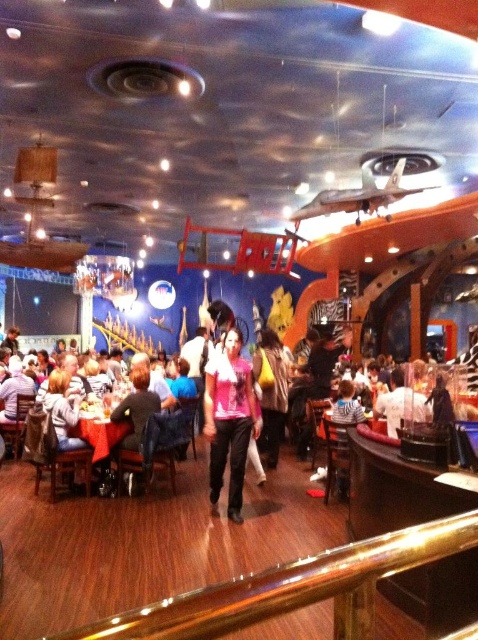
You are a customer sitting at a table in the restaurant and want to reach the shiny polished wood rail at lower center and the pink fabric shirt at center. Which object is located to the right of the other?

The shiny polished wood rail at lower center is positioned on the right side of pink fabric shirt at center, so the shiny polished wood rail at lower center is to the right of the pink fabric shirt at center.

You are a customer sitting at a table in this restaurant and want to reach the coat rack located at the entrance. You see a pink fabric shirt at center. If the shirt is 4.64 meters away from you, can you estimate whether the coat rack is closer or farther than the shirt?

The pink fabric shirt at center is 4.64 meters away from the viewer. Since the coat rack is at the entrance, it is likely closer to you than the shirt, assuming the entrance is near your table.

You are a customer sitting at the red tablecloth at lower left in this restaurant. You want to reach the shiny polished wood rail at lower center to grab a menu. Is the rail to your right or left side?

The shiny polished wood rail at lower center is positioned on the right side of red tablecloth at lower left, so it is to your right side.